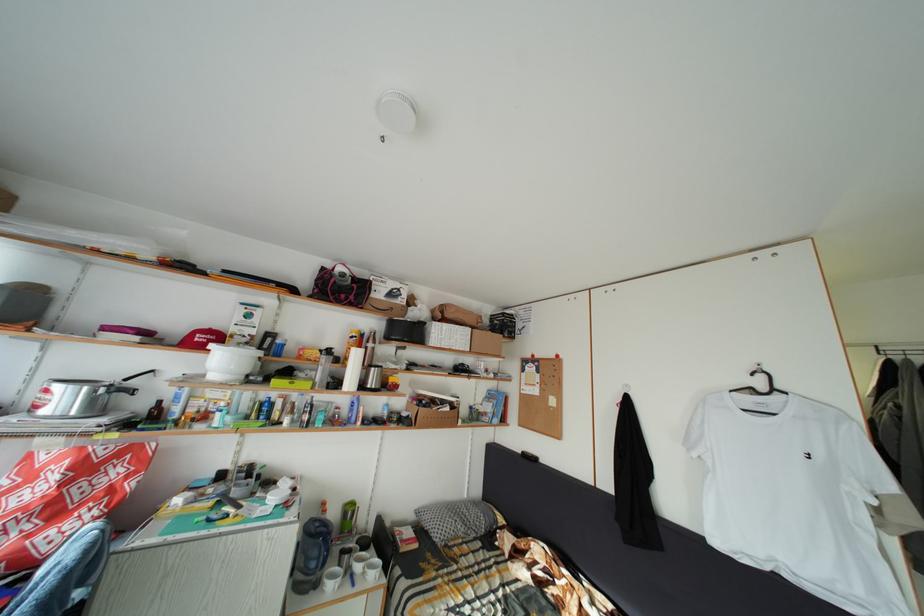
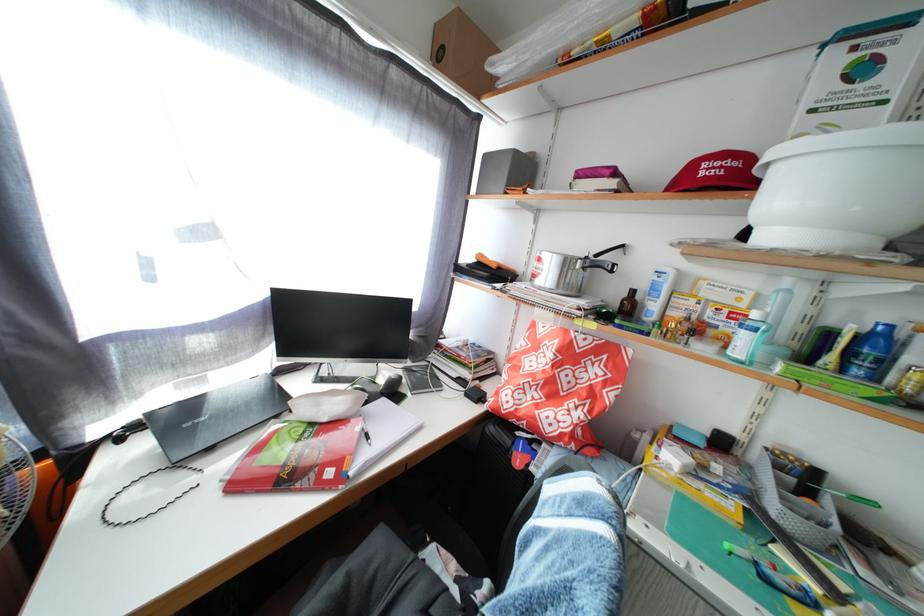
Find the pixel in the second image that matches the point at 271,424 in the first image.

(866, 378)